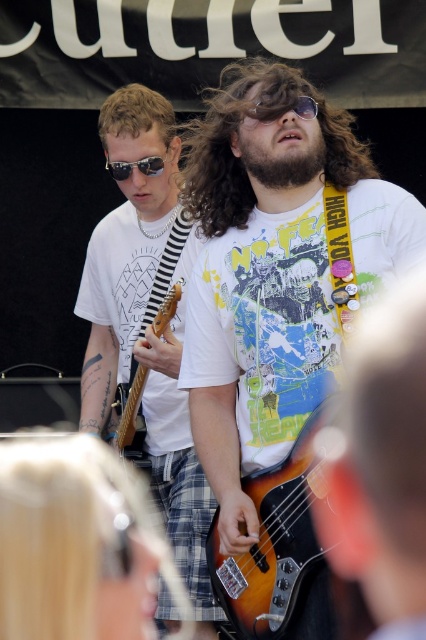
Question: Considering the real-world distances, which object is farthest from the sunburst wood bass guitar at center?

Choices:
 (A) matte white t-shirt at center
 (B) white matte t-shirt at center

Answer: (B)

Question: Which point is closer to the camera?

Choices:
 (A) matte white t-shirt at center
 (B) sunburst wood bass guitar at center
 (C) blondehair at left

Answer: (B)

Question: Which point appears farthest from the camera in this image?

Choices:
 (A) (146, 378)
 (B) (146, 426)
 (C) (114, 93)
 (D) (175, 161)

Answer: (D)

Question: Can you confirm if sunburst wood bass guitar at center is thinner than transparent plastic goggles at center?

Choices:
 (A) yes
 (B) no

Answer: (B)

Question: In this image, where is sunglasses at center located relative to transparent plastic goggles at center?

Choices:
 (A) left
 (B) right

Answer: (A)

Question: Can you confirm if white printed t-shirt at left is bigger than brown fuzzy beard at center?

Choices:
 (A) yes
 (B) no

Answer: (A)